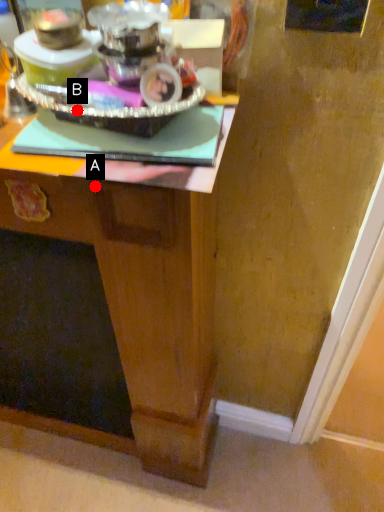
Question: Two points are circled on the image, labeled by A and B beside each circle. Which point is closer to the camera?

Choices:
 (A) A is closer
 (B) B is closer

Answer: (B)